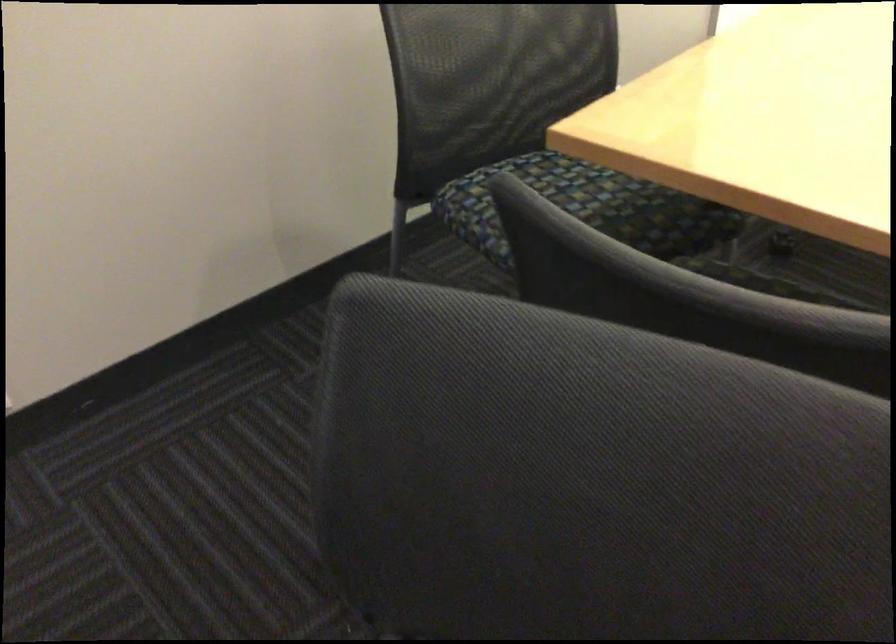
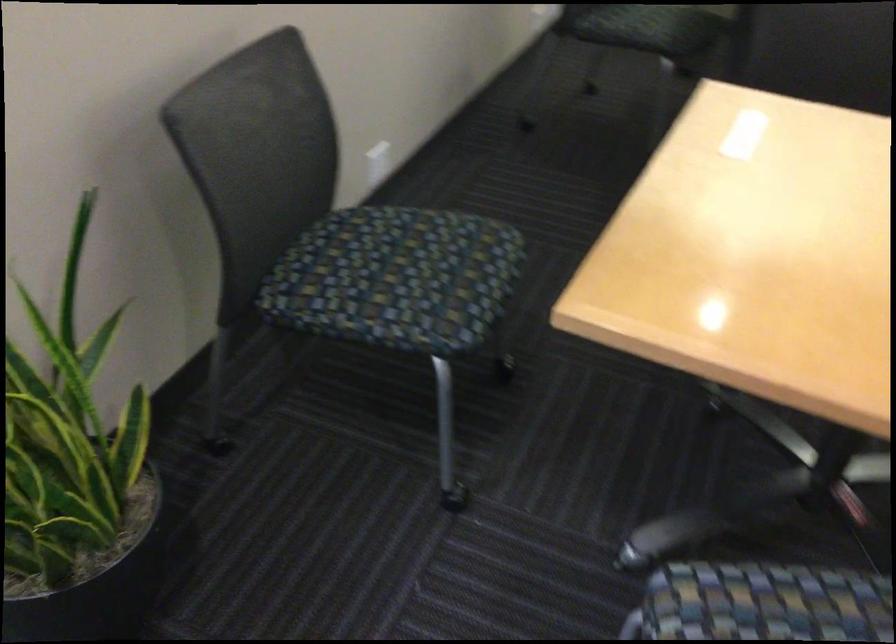
The images are taken continuously from a first-person perspective. In which direction are you moving?

The movement direction of the cameraman is left, backward.